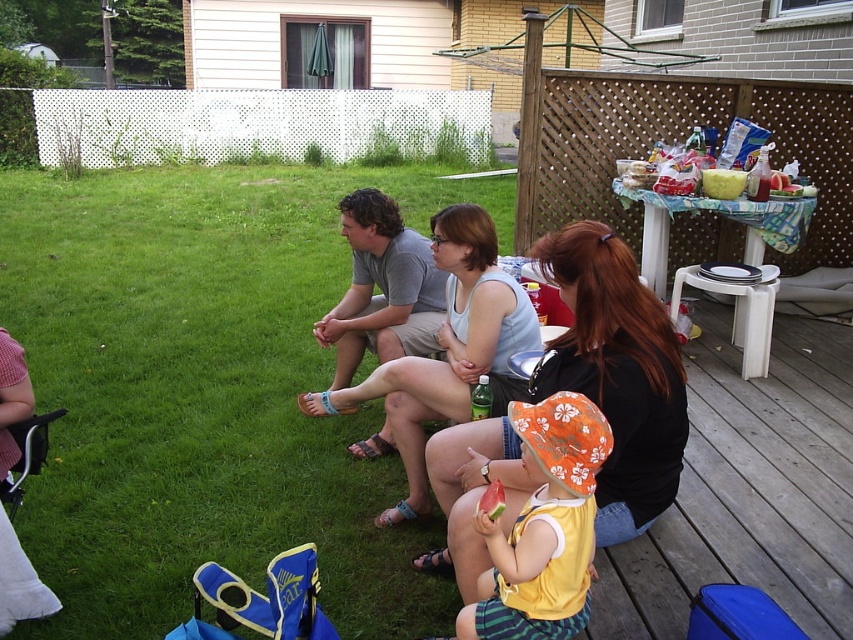
Question: Which of the following is the farthest from the observer?

Choices:
 (A) (367, 252)
 (B) (321, 186)
 (C) (402, 371)
 (D) (604, 243)

Answer: (B)

Question: Which point appears farthest from the camera in this image?

Choices:
 (A) (373, 260)
 (B) (486, 589)
 (C) (165, 596)

Answer: (A)

Question: Does matte black tank top at center have a larger size compared to gray cotton shirt at center?

Choices:
 (A) yes
 (B) no

Answer: (B)

Question: Does matte black tank top at center appear on the right side of gray cotton shirt at center?

Choices:
 (A) yes
 (B) no

Answer: (A)

Question: Does light blue tank top at center come behind yellow cotton shirt at lower center?

Choices:
 (A) no
 (B) yes

Answer: (B)

Question: Which object appears closest to the camera in this image?

Choices:
 (A) matte black tank top at center
 (B) green grass at lower left
 (C) yellow cotton shirt at lower center

Answer: (C)